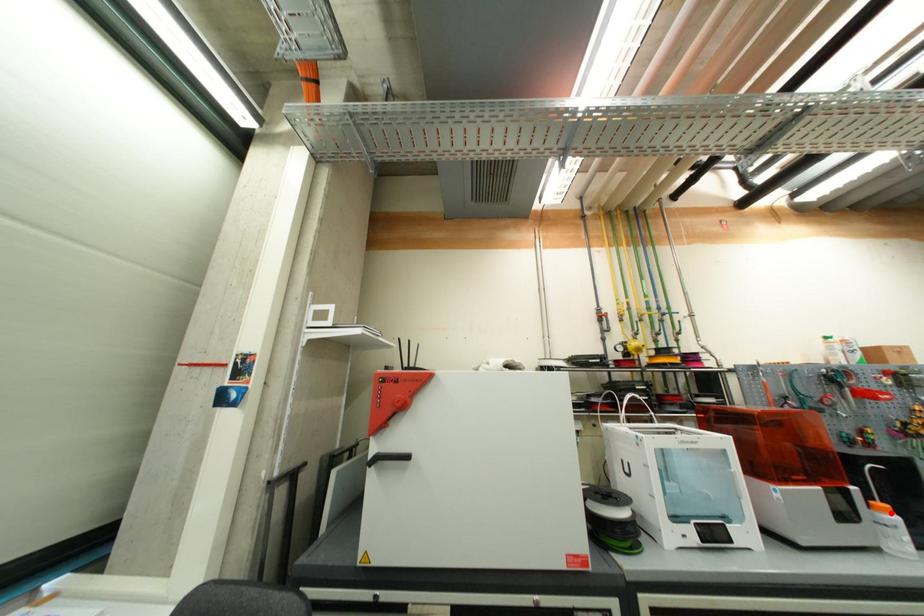
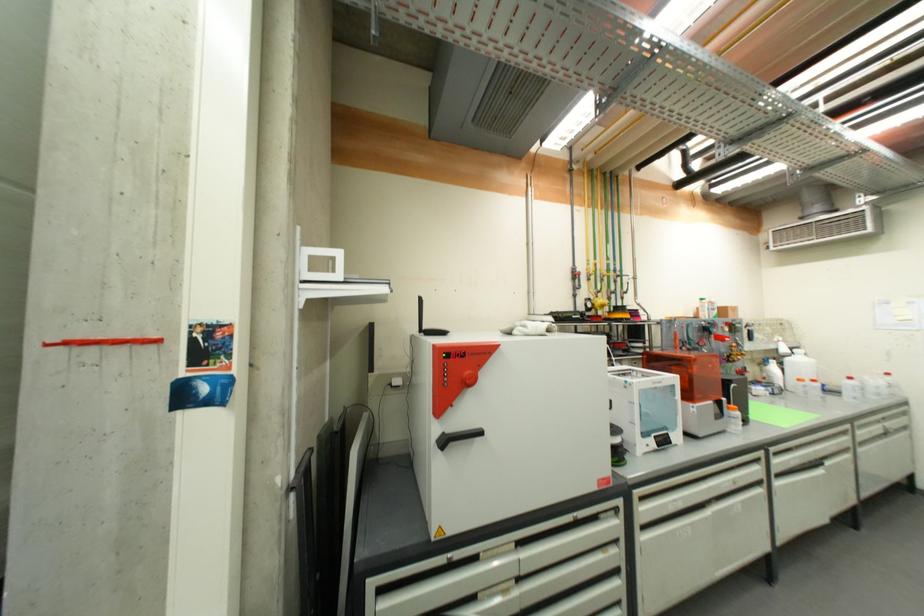
Question: I am providing you with two images of the same scene from different viewpoints. A red point is marked on the first image. At the location where the point appears in image 1, is it still visible in image 2?

Choices:
 (A) Yes
 (B) No

Answer: (A)